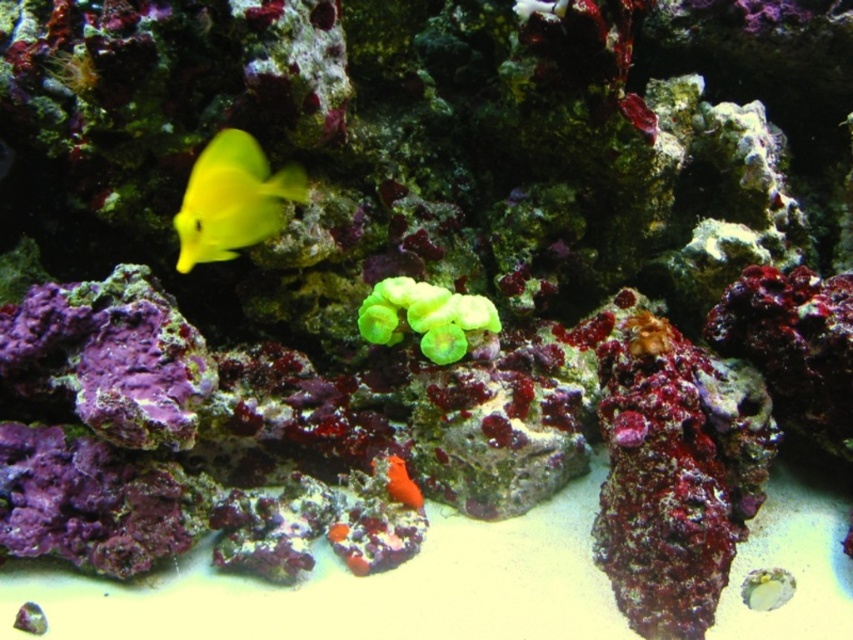
How distant is yellow matte fish at upper left from green matte coral at center?

The distance of yellow matte fish at upper left from green matte coral at center is 11.41 inches.

Identify the location of yellow matte fish at upper left. Image resolution: width=853 pixels, height=640 pixels. (231, 198).

Can you confirm if green matte coral at center is positioned above orange matte sponge at lower center?

Yes, green matte coral at center is above orange matte sponge at lower center.

Can you confirm if green matte coral at center is thinner than orange matte sponge at lower center?

No.

Locate an element on the screen. green matte coral at center is located at coordinates (425, 317).

Can you confirm if yellow matte fish at upper left is wider than orange matte sponge at lower center?

Indeed, yellow matte fish at upper left has a greater width compared to orange matte sponge at lower center.

Can you confirm if yellow matte fish at upper left is smaller than orange matte sponge at lower center?

Actually, yellow matte fish at upper left might be larger than orange matte sponge at lower center.

Between point (215, 259) and point (409, 484), which one is positioned in front?

Point (215, 259) is in front.

This screenshot has height=640, width=853. Find the location of `yellow matte fish at upper left`. yellow matte fish at upper left is located at coordinates (231, 198).